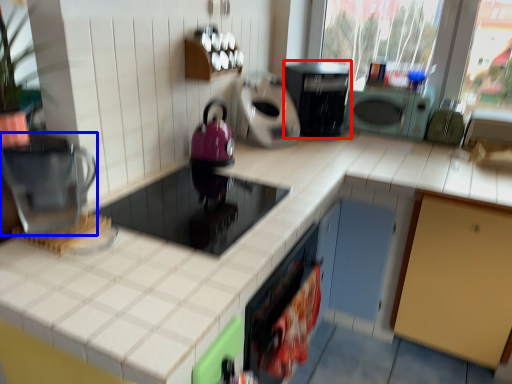
Question: Which object is further to the camera taking this photo, home appliance (highlighted by a red box) or kitchen appliance (highlighted by a blue box)?

Choices:
 (A) home appliance
 (B) kitchen appliance

Answer: (A)